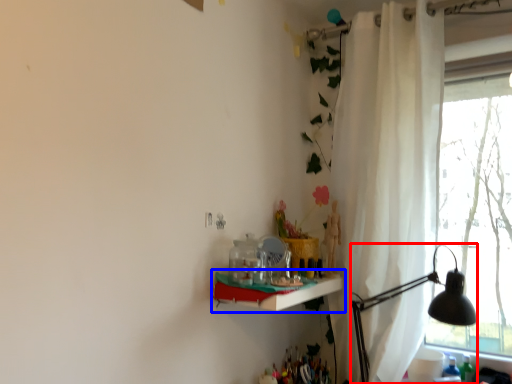
Question: Which point is further to the camera, table lamp (highlighted by a red box) or shelf (highlighted by a blue box)?

Choices:
 (A) table lamp
 (B) shelf

Answer: (A)